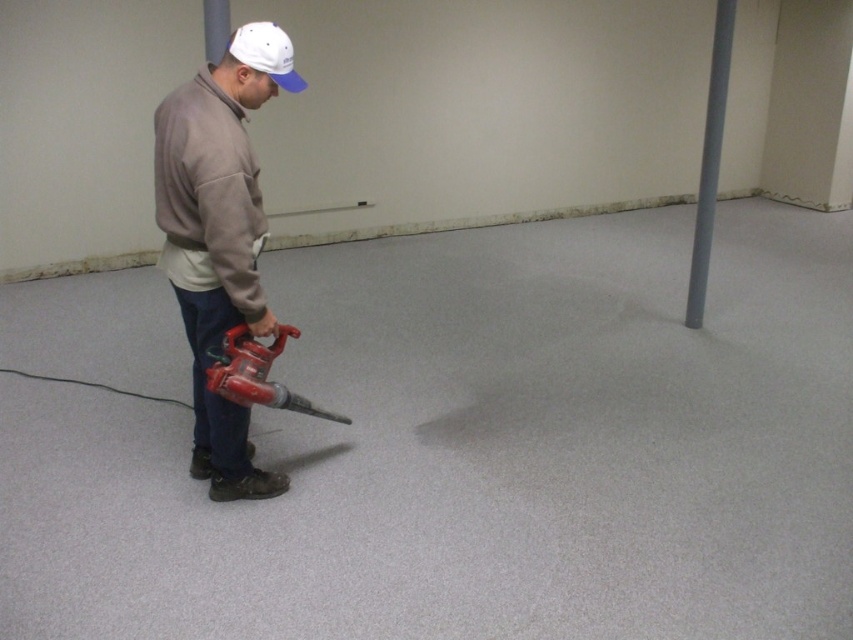
Is matte gray jacket at left thinner than white fabric cap at upper center?

In fact, matte gray jacket at left might be wider than white fabric cap at upper center.

Is matte gray jacket at left positioned at the back of white fabric cap at upper center?

That is False.

What do you see at coordinates (219, 236) in the screenshot? I see `matte gray jacket at left` at bounding box center [219, 236].

Find the location of a particular element. matte gray jacket at left is located at coordinates (219, 236).

Is gray carpet at center taller than white fabric cap at upper center?

Yes, gray carpet at center is taller than white fabric cap at upper center.

Can you confirm if gray carpet at center is positioned below white fabric cap at upper center?

Yes, gray carpet at center is below white fabric cap at upper center.

Who is more distant from viewer, (270, 572) or (264, 24)?

The point (270, 572) is more distant.

This screenshot has height=640, width=853. In order to click on gray carpet at center in this screenshot , I will do `click(479, 451)`.

Can you confirm if matte gray jacket at left is positioned below red plastic leaf blower at lower left?

Actually, matte gray jacket at left is above red plastic leaf blower at lower left.

This screenshot has height=640, width=853. I want to click on matte gray jacket at left, so click(x=219, y=236).

The height and width of the screenshot is (640, 853). I want to click on matte gray jacket at left, so click(219, 236).